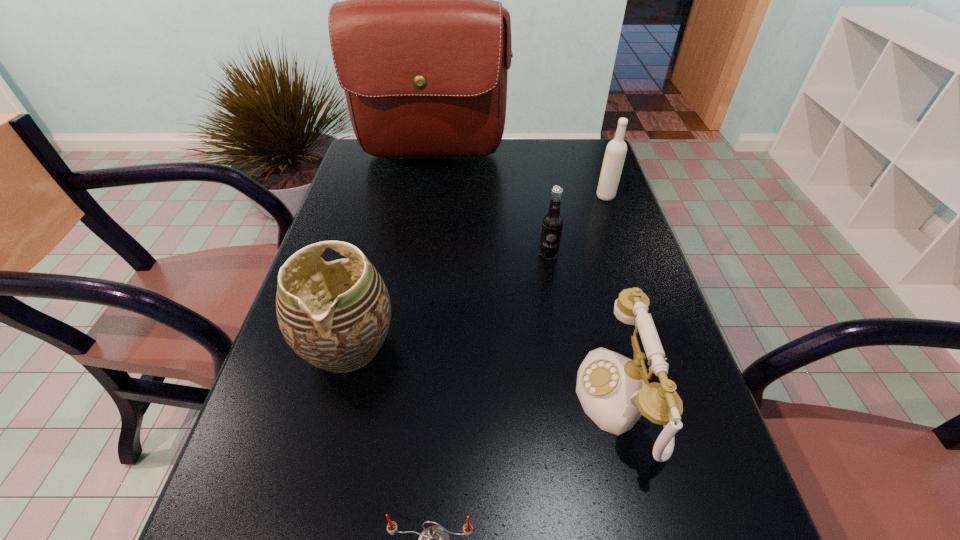
This screenshot has height=540, width=960. In order to click on the tallest object in this screenshot , I will do tap(421, 48).

What are the coordinates of `satchel` in the screenshot? It's located at 421,48.

The image size is (960, 540). I want to click on the fifth nearest object, so click(616, 150).

Where is `pottery`? pottery is located at coordinates (335, 315).

I want to click on root beer, so (552, 223).

Locate an element on the screen. The image size is (960, 540). telephone is located at coordinates (614, 392).

This screenshot has height=540, width=960. I want to click on blank space located on the open flap of the satchel, so click(x=427, y=190).

Identify the location of free space located on the back of the second farthest object. This screenshot has height=540, width=960. (588, 146).

Identify the location of vacant space located on the right of the pottery. This screenshot has height=540, width=960. (496, 346).

Locate an element on the screen. The image size is (960, 540). vacant area situated 0.360m on the label of the third farthest object is located at coordinates (571, 391).